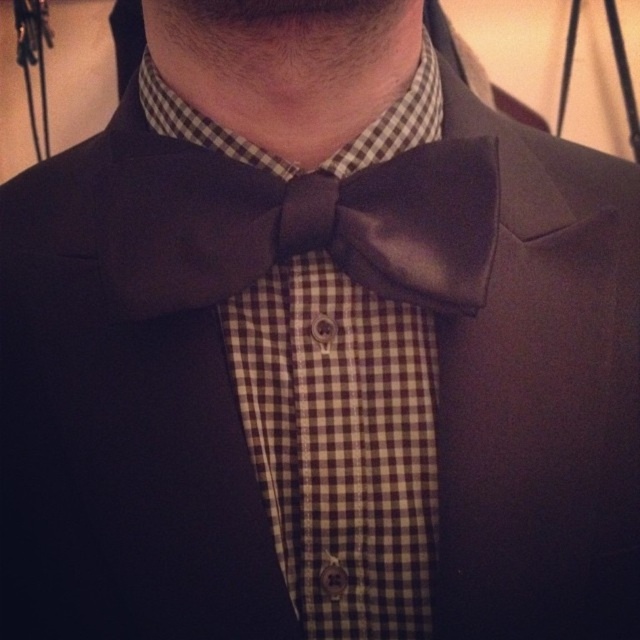
Question: Is brown checkered shirt at center wider than white checkered fabric at center?

Choices:
 (A) yes
 (B) no

Answer: (B)

Question: Which object appears farthest from the camera in this image?

Choices:
 (A) shiny brown bow tie at center
 (B) white checkered fabric at center
 (C) brown checkered shirt at center

Answer: (B)

Question: Which of the following is the closest to the observer?

Choices:
 (A) (362, 456)
 (B) (404, 188)

Answer: (B)

Question: Does shiny brown bow tie at center have a smaller size compared to white checkered fabric at center?

Choices:
 (A) yes
 (B) no

Answer: (B)

Question: Among these objects, which one is farthest from the camera?

Choices:
 (A) shiny brown bow tie at center
 (B) white checkered fabric at center
 (C) brown checkered shirt at center

Answer: (B)

Question: Is brown checkered shirt at center positioned before shiny brown bow tie at center?

Choices:
 (A) yes
 (B) no

Answer: (B)